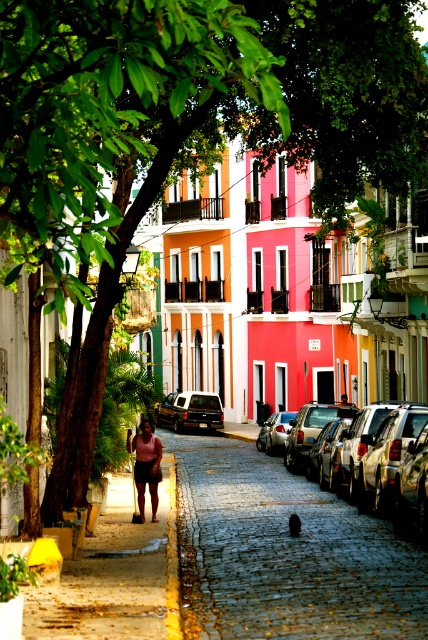
Question: Which point is farther to the camera?

Choices:
 (A) shiny silver car at center
 (B) cobblestone pavement at center
 (C) metallic silver car at center

Answer: (C)

Question: Which point is closer to the camera?

Choices:
 (A) (199, 422)
 (B) (137, 467)
 (C) (306, 490)
 (D) (372, 403)

Answer: (B)

Question: Does cobblestone pavement at center have a smaller size compared to shiny silver car at center?

Choices:
 (A) yes
 (B) no

Answer: (B)

Question: Is cobblestone pavement at center smaller than shiny silver car at center?

Choices:
 (A) no
 (B) yes

Answer: (A)

Question: Can you confirm if cobblestone pavement at center is positioned to the left of shiny silver car at center?

Choices:
 (A) yes
 (B) no

Answer: (A)

Question: Which point is closer to the camera?

Choices:
 (A) (190, 396)
 (B) (327, 611)

Answer: (B)